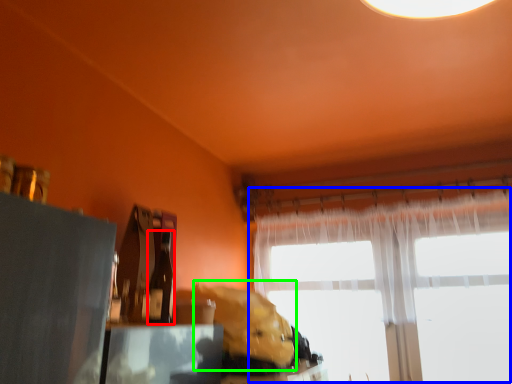
Question: Based on their relative distances, which object is nearer to bottle (highlighted by a red box)? Choose from window (highlighted by a blue box) and animal (highlighted by a green box).

Choices:
 (A) window
 (B) animal

Answer: (B)